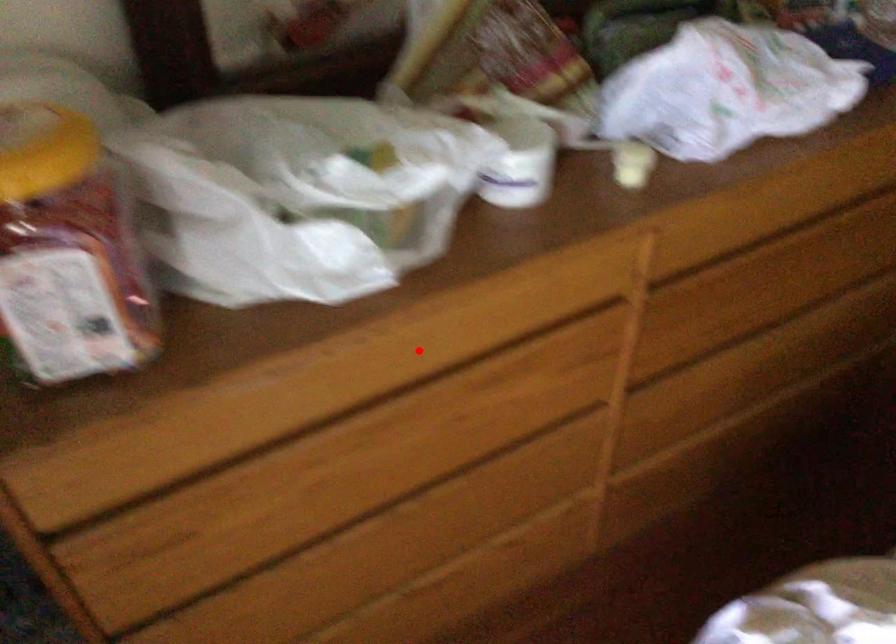
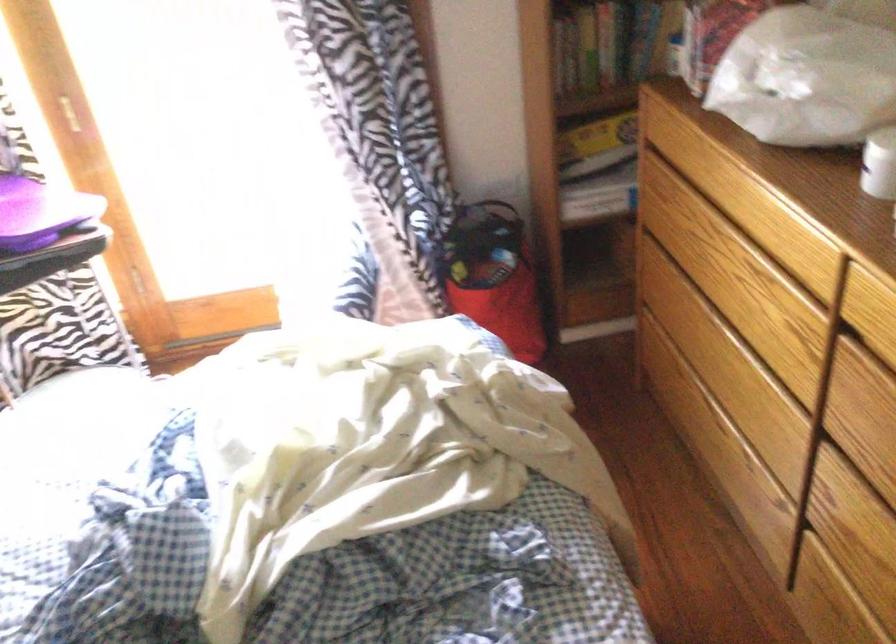
Question: A red point is marked in image1. In image2, is the corresponding 3D point closer to the camera or farther? Reply with the corresponding letter.

Choices:
 (A) The corresponding 3D point is closer.
 (B) The corresponding 3D point is farther.

Answer: (B)